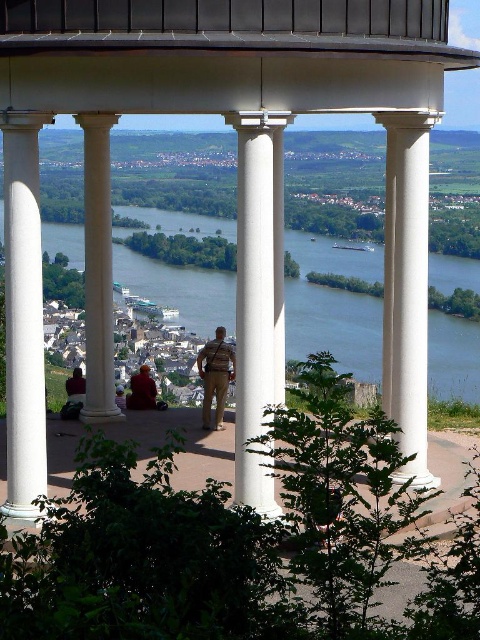
Between white marble pillar at center and white marble column at center, which one is positioned lower?

white marble column at center is lower down.

Who is higher up, white marble pillar at center or white marble column at center?

white marble pillar at center is higher up.

Between point (247, 264) and point (415, 316), which one is positioned in front?

Point (247, 264) is more forward.

Locate an element on the screen. white marble pillar at center is located at coordinates (259, 294).

What do you see at coordinates (407, 288) in the screenshot?
I see `white marble column at center` at bounding box center [407, 288].

Measure the distance from white marble column at center to light brown leather jacket at center.

A distance of 13.90 meters exists between white marble column at center and light brown leather jacket at center.

The width and height of the screenshot is (480, 640). I want to click on white marble column at center, so click(x=407, y=288).

Does point (207, 323) come in front of point (82, 372)?

No, it is not.

Which of these two, green water at center or matte black jacket at lower left, stands shorter?

With less height is matte black jacket at lower left.

Does point (478, 385) come farther from viewer compared to point (69, 396)?

Yes, it is.

Where is `green water at center`? green water at center is located at coordinates (334, 307).